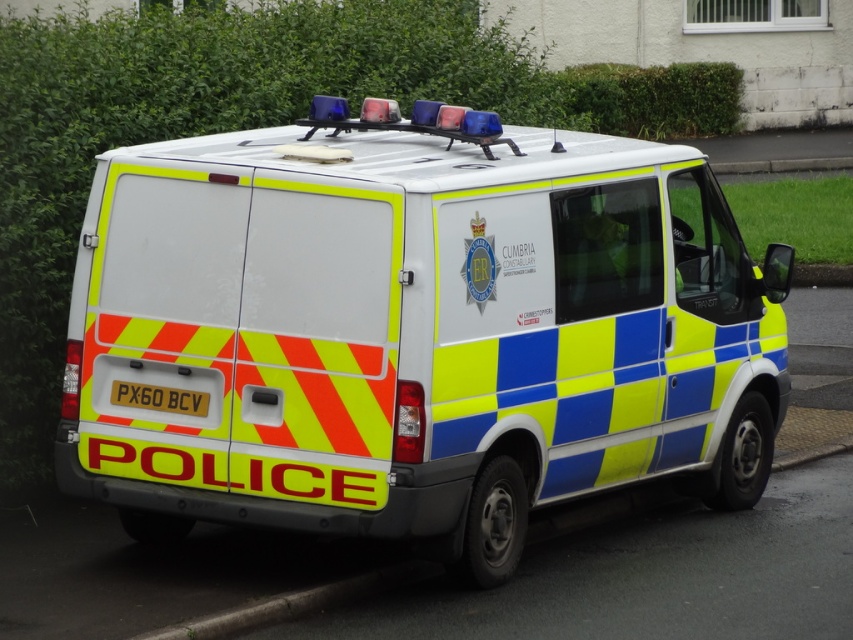
Is reflective plastic police van at center to the right of yellow reflective plastic at rear from the viewer's perspective?

Indeed, reflective plastic police van at center is positioned on the right side of yellow reflective plastic at rear.

Does point (734, 353) come in front of point (126, 404)?

No.

This screenshot has width=853, height=640. What are the coordinates of `reflective plastic police van at center` in the screenshot? It's located at (415, 336).